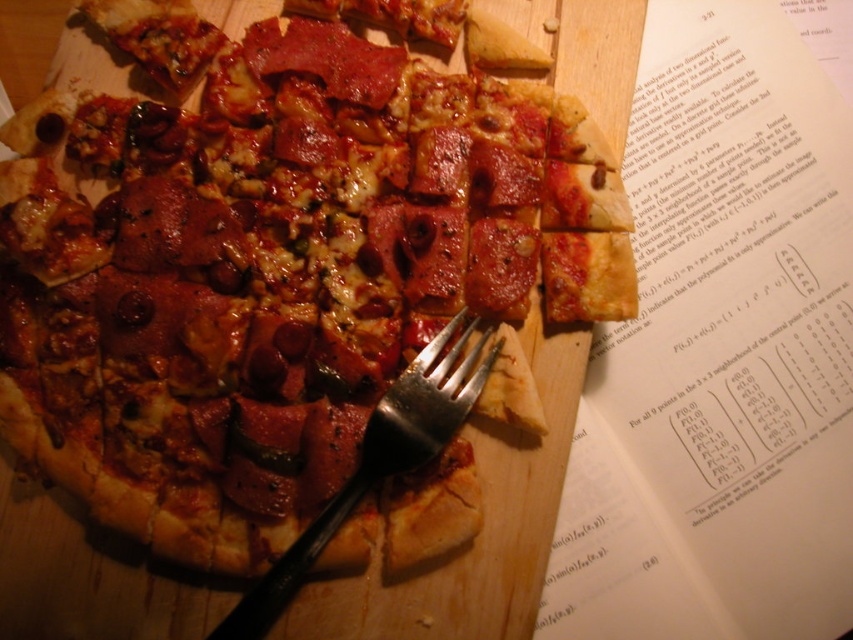
Is point (358, 324) positioned in front of point (683, 67)?

Yes, it is in front of point (683, 67).

Image resolution: width=853 pixels, height=640 pixels. Describe the element at coordinates (259, 317) in the screenshot. I see `matte pepperoni pizza at center` at that location.

Where is `matte pepperoni pizza at center`? The width and height of the screenshot is (853, 640). matte pepperoni pizza at center is located at coordinates (259, 317).

Image resolution: width=853 pixels, height=640 pixels. What are the coordinates of `matte pepperoni pizza at center` in the screenshot? It's located at [259, 317].

Can you confirm if matte pizza slice at upper right is shorter than silver metallic fork at center?

No.

Consider the image. Which of these two, matte pizza slice at upper right or silver metallic fork at center, stands taller?

Standing taller between the two is matte pizza slice at upper right.

The width and height of the screenshot is (853, 640). In order to click on matte pizza slice at upper right in this screenshot , I will do `click(722, 346)`.

At what (x,y) coordinates should I click in order to perform the action: click on matte pizza slice at upper right. Please return your answer as a coordinate pair (x, y). Looking at the image, I should click on [722, 346].

Who is more distant from viewer, (454,173) or (405,413)?

Positioned behind is point (454,173).

Can you confirm if matte pepperoni pizza at center is smaller than silver metallic fork at center?

Incorrect, matte pepperoni pizza at center is not smaller in size than silver metallic fork at center.

Locate an element on the screen. Image resolution: width=853 pixels, height=640 pixels. matte pepperoni pizza at center is located at coordinates (259, 317).